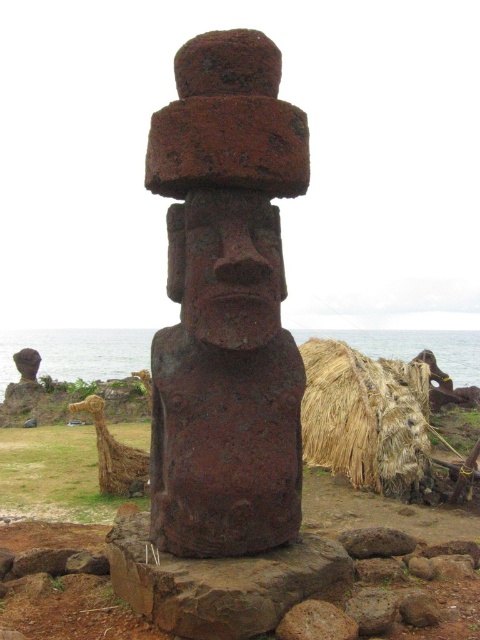
You are standing at point 0.5, 0.5 in the image. Which direction should you move to reach the rusty stone statue at center?

The rusty stone statue at center is located at point (x=226, y=305), so you should move slightly to the southwest to reach it from your current position at (x=240, y=320).